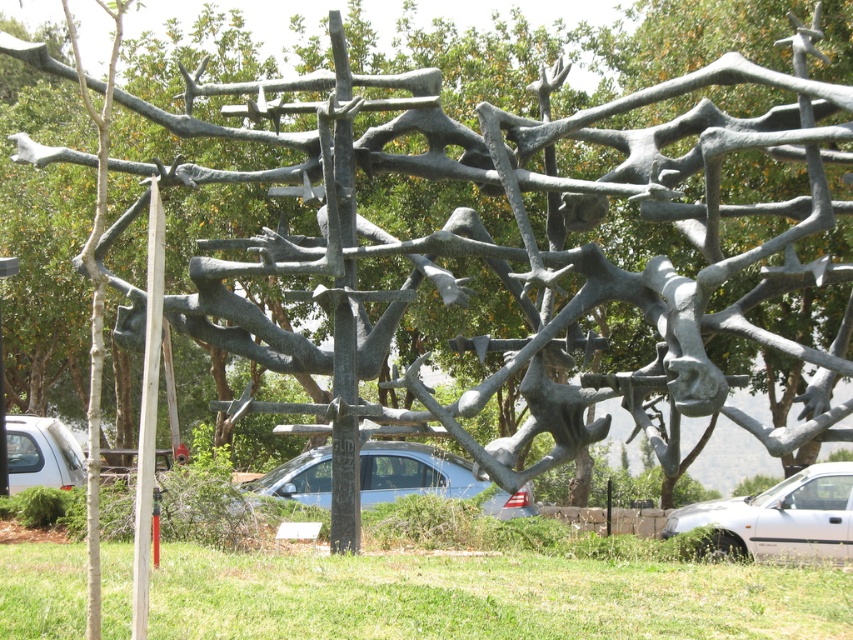
You are standing in the park and want to take a photo of the bronze textured pole at center. If your camera has a maximum focus range of 30 feet, will you need to move closer to capture it clearly?

The bronze textured pole at center is 33.43 feet away from the camera, which exceeds the maximum focus range of 30 feet. Therefore, you need to move closer to ensure the bronze textured pole at center is in focus.

In the scene shown: You are standing at the entrance of the park and see the satin silver car at center. If you want to walk directly towards the car, which direction should you head?

The satin silver car at center is located at point coordinates, so you should walk towards the center of the park to reach it.